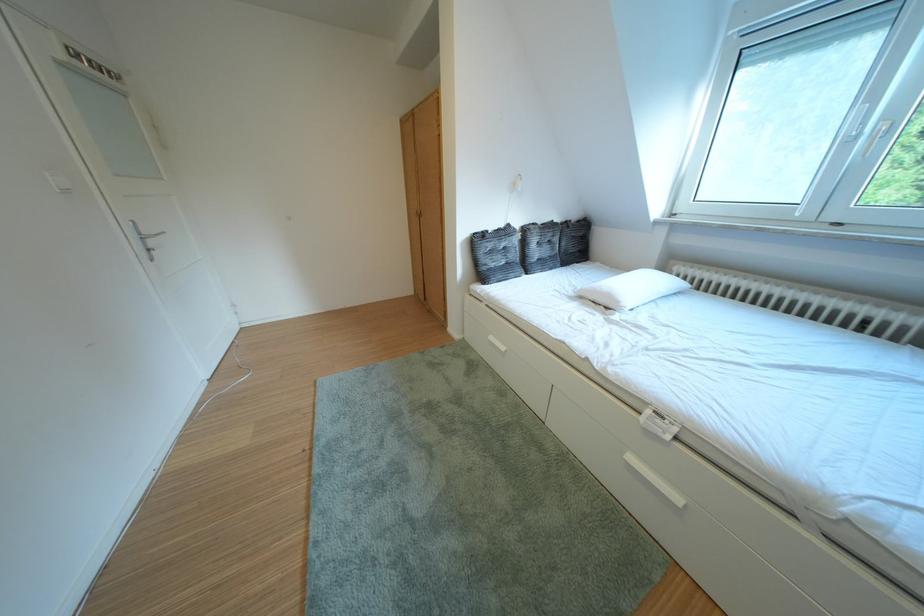
Find where to turn the silver door handle. Please return your answer as a coordinate pair (x, y).

(146, 238)